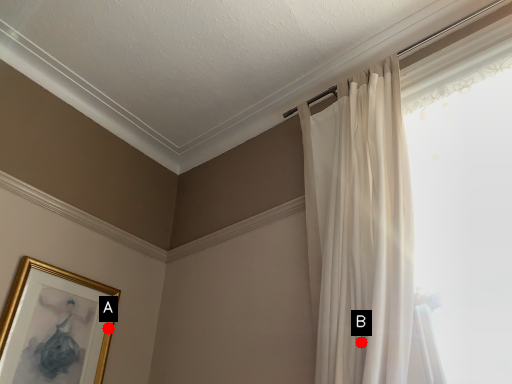
Question: Two points are circled on the image, labeled by A and B beside each circle. Which point appears farthest from the camera in this image?

Choices:
 (A) A is further
 (B) B is further

Answer: (A)